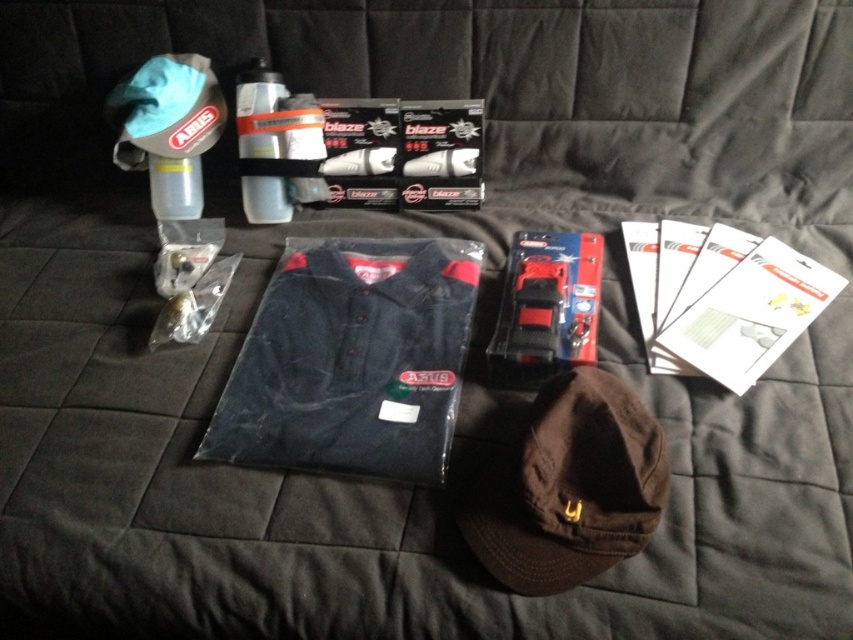
Question: Which is nearer to the matte gray water bottle at upper left?

Choices:
 (A) white paper at upper right
 (B) brown cotton cap at center
 (C) navy blue fabric at center

Answer: (C)

Question: Does navy blue fabric at center appear on the right side of white paper at upper right?

Choices:
 (A) yes
 (B) no

Answer: (B)

Question: Can you confirm if navy blue fabric at center is positioned below matte gray water bottle at upper left?

Choices:
 (A) no
 (B) yes

Answer: (B)

Question: Which object is farther from the camera taking this photo?

Choices:
 (A) matte gray water bottle at upper left
 (B) brown cotton cap at center

Answer: (A)

Question: Which point is closer to the camera?

Choices:
 (A) white paper at upper right
 (B) navy blue fabric at center

Answer: (B)

Question: In this image, where is navy blue fabric at center located relative to brown cotton cap at center?

Choices:
 (A) below
 (B) above

Answer: (B)